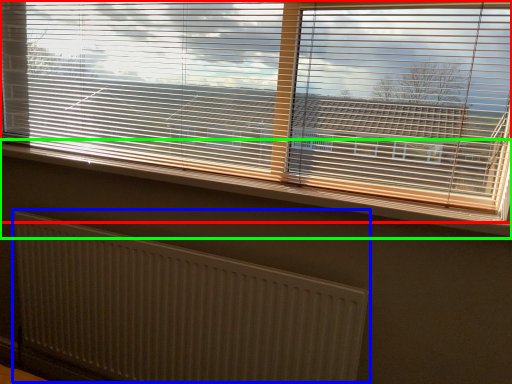
Question: Estimate the real-world distances between objects in this image. Which object is closer to window blind (highlighted by a red box), radiator (highlighted by a blue box) or window sill (highlighted by a green box)?

Choices:
 (A) radiator
 (B) window sill

Answer: (B)